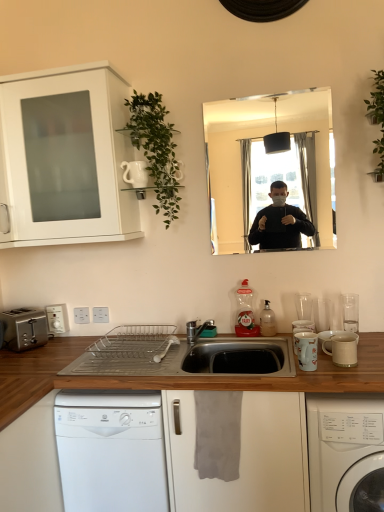
The width and height of the screenshot is (384, 512). In order to click on vacant area located to the right-hand side of white glossy mug at right, the 2th appliance positioned from the left in this screenshot , I will do pyautogui.click(x=337, y=372).